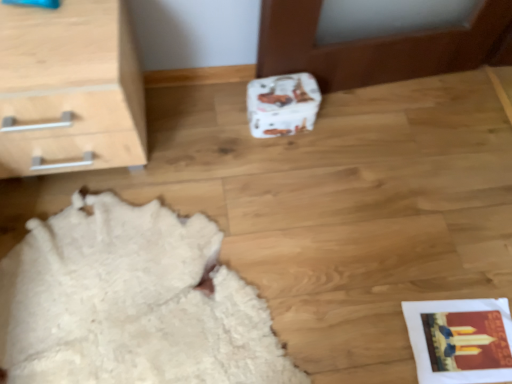
This screenshot has height=384, width=512. I want to click on blank space to the left of white paper shoe box at center, so (223, 119).